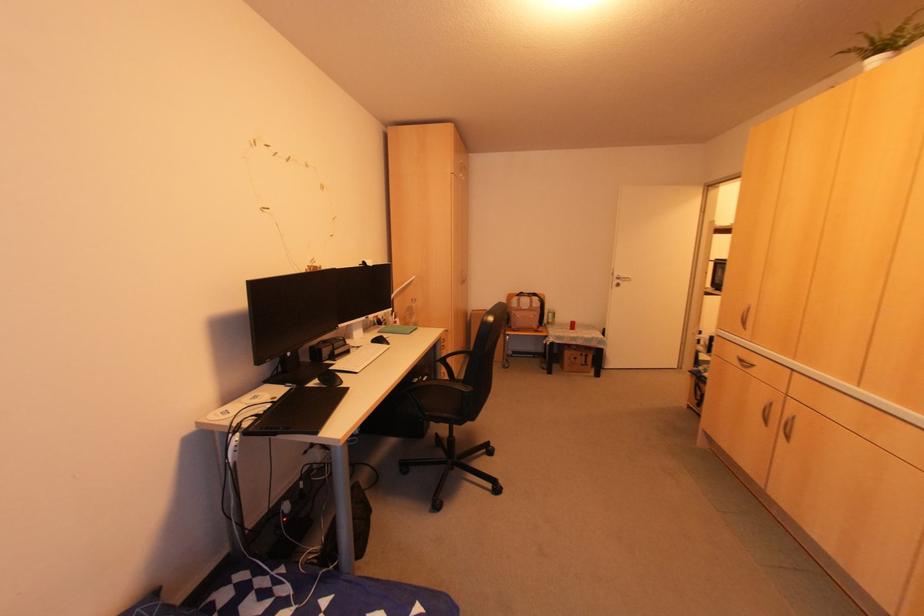
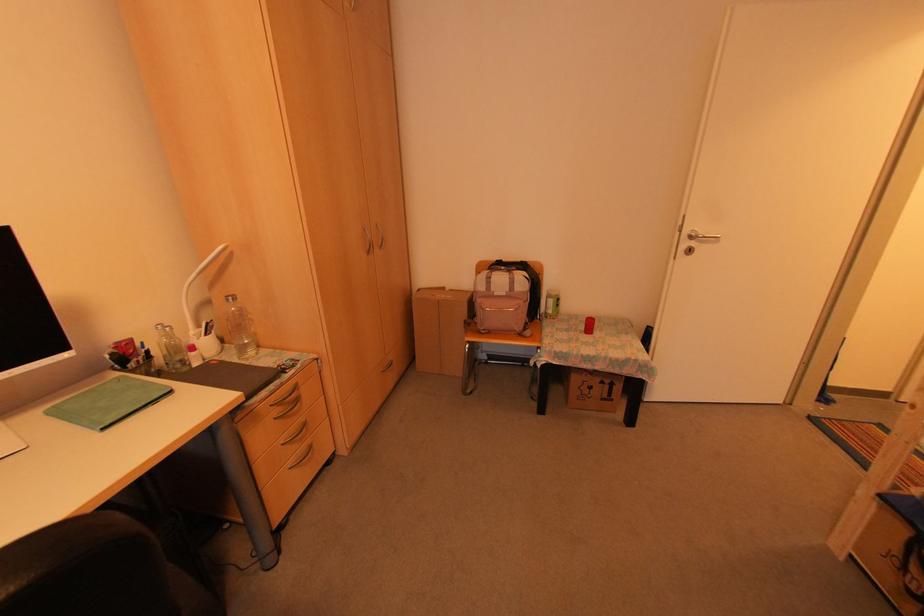
Locate, in the second image, the point that corresponds to point 578,354 in the first image.

(598, 381)